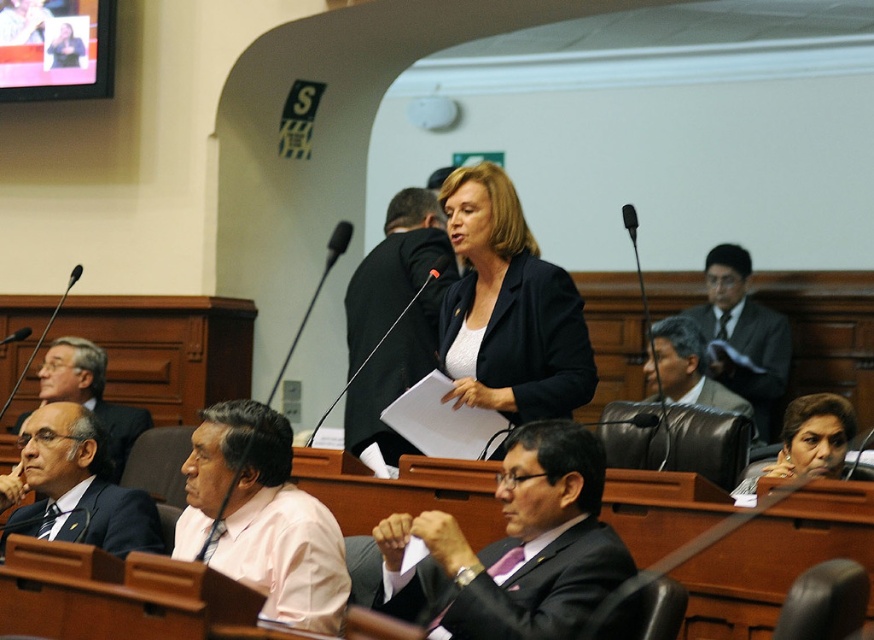
Which is behind, point (71, 422) or point (802, 464)?

The point (71, 422) is more distant.

Which of these two, dark suit at left or matte black hair at center, stands taller?

With more height is dark suit at left.

Is point (140, 522) less distant than point (779, 472)?

Yes, it is.

Identify the location of dark suit at left. (80, 484).

Is black matte jacket at center further to camera compared to matte black hair at center?

Yes.

Is black matte jacket at center shorter than matte black hair at center?

No.

Locate an element on the screen. This screenshot has width=874, height=640. black matte jacket at center is located at coordinates (393, 317).

Looking at this image, who is shorter, matte black blazer at center or dark suit at left?

dark suit at left

Which is behind, point (446, 320) or point (51, 518)?

Positioned behind is point (446, 320).

Where is `matte black blazer at center`? Image resolution: width=874 pixels, height=640 pixels. matte black blazer at center is located at coordinates (508, 308).

Identify the location of matte black blazer at center. (508, 308).